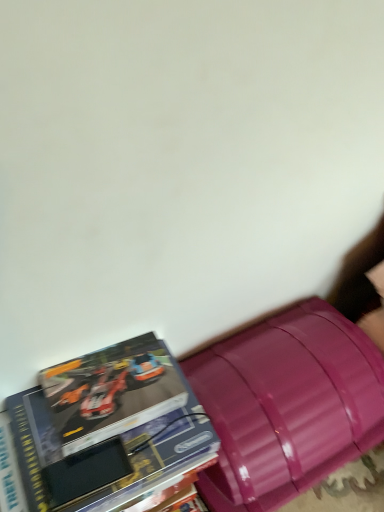
Question: Should I look upward or downward to see hardcover book at lower left?

Choices:
 (A) down
 (B) up

Answer: (A)